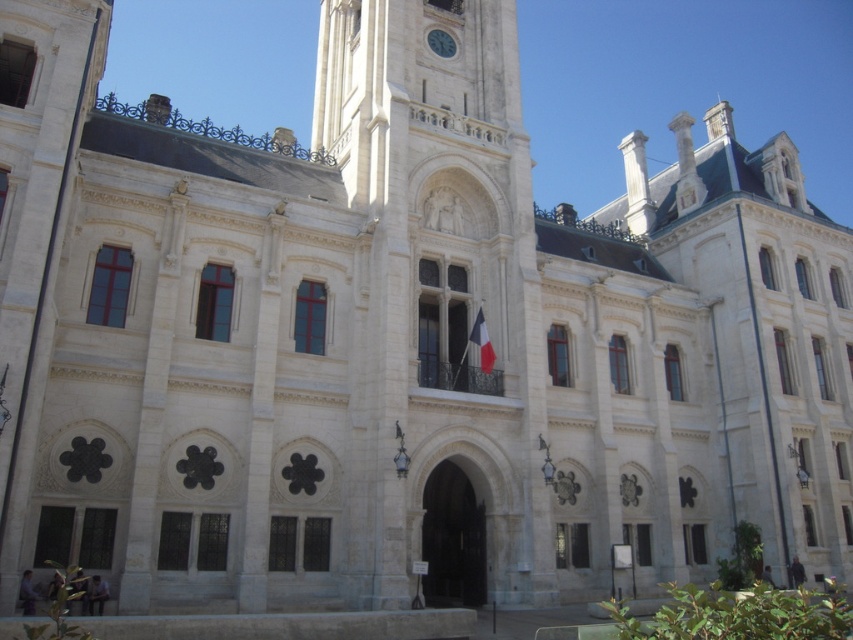
In the scene shown: Is polished fabric flag at center taller than white stone clock at upper center?

Yes.

Between polished fabric flag at center and white stone clock at upper center, which one has more height?

polished fabric flag at center

Is point (479, 308) less distant than point (432, 44)?

That is True.

Find the location of a particular element. polished fabric flag at center is located at coordinates [482, 340].